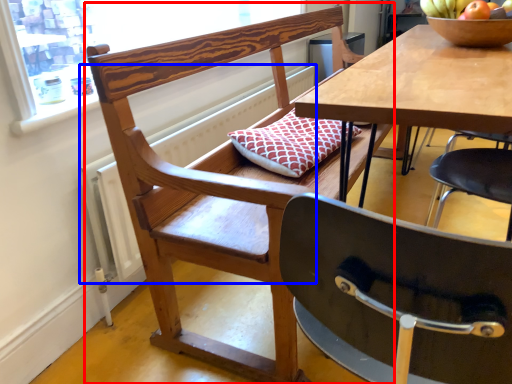
Question: Among these objects, which one is nearest to the camera, chair (highlighted by a red box) or radiator (highlighted by a blue box)?

Choices:
 (A) chair
 (B) radiator

Answer: (A)